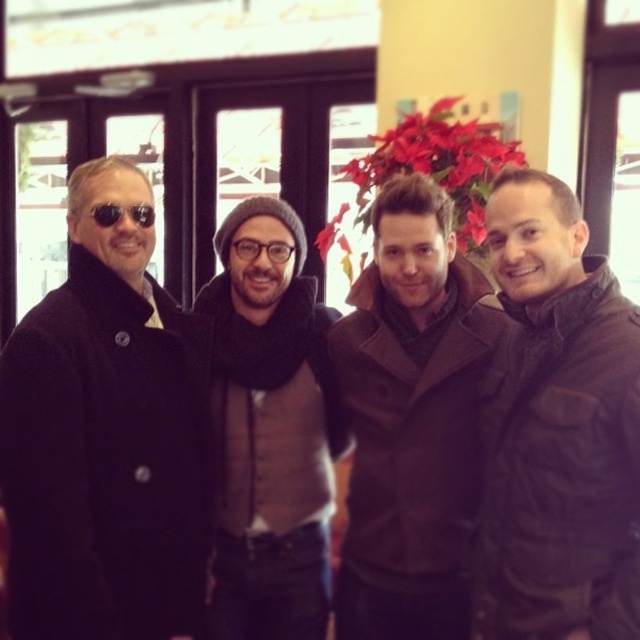
You are standing in the same room as the four men and want to move closer to the point labeled as point (387, 152). Which direction should you move relative to the point labeled point (253, 256)?

To move closer to point (387, 152), you should move towards the direction of the camera compared to point (253, 256) since point (387, 152) is closer to the camera.

In the scene described, there are two items of clothing visible. The black wool coat at left and the brown suede vest at center. Which clothing item is positioned higher up in the image?

The black wool coat at left is positioned higher up in the image than the brown suede vest at center.

You are trying to decide which item to purchase between the black wool coat at left and the brown suede vest at center. Based on their sizes, which one would be more suitable for someone who prefers larger, roomier clothing?

The black wool coat at left is larger in size than the brown suede vest at center, so it would be more suitable for someone who prefers larger, roomier clothing.